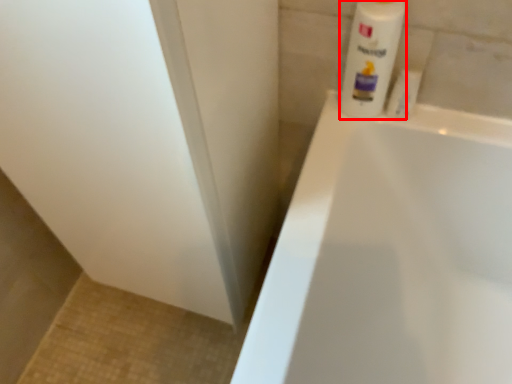
Question: Observing the image, what is the correct spatial positioning of cleaning product (annotated by the red box) in reference to toiletry?

Choices:
 (A) left
 (B) right

Answer: (A)